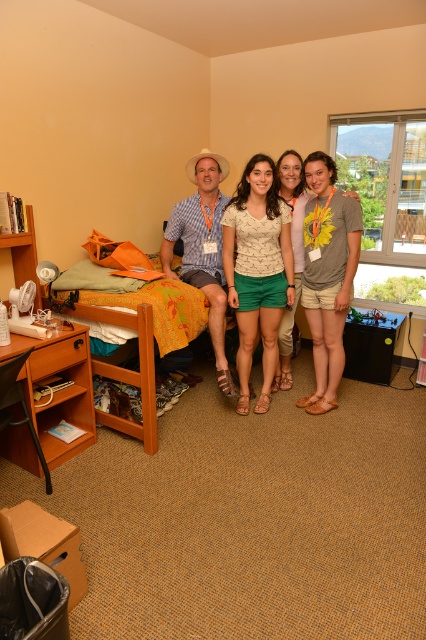
Does matte white shirt at center have a lesser height compared to wooden bed at left?

No.

Is matte white shirt at center smaller than wooden bed at left?

Actually, matte white shirt at center might be larger than wooden bed at left.

This screenshot has width=426, height=640. What are the coordinates of `matte white shirt at center` in the screenshot? It's located at (258, 308).

This screenshot has height=640, width=426. I want to click on matte white shirt at center, so click(x=258, y=308).

This screenshot has width=426, height=640. I want to click on matte white blouse at center, so click(x=258, y=269).

Who is positioned more to the left, matte white blouse at center or wooden bed at left?

wooden bed at left is more to the left.

Measure the distance between point (265, 314) and camera.

Point (265, 314) and camera are 10.08 feet apart from each other.

This screenshot has width=426, height=640. Identify the location of matte white blouse at center. (258, 269).

Is matte white shirt at center above matte yellow hat at center?

No.

Is point (270, 212) in front of point (213, 221)?

Yes, point (270, 212) is in front of point (213, 221).

Image resolution: width=426 pixels, height=640 pixels. Identify the location of matte white shirt at center. (258, 308).